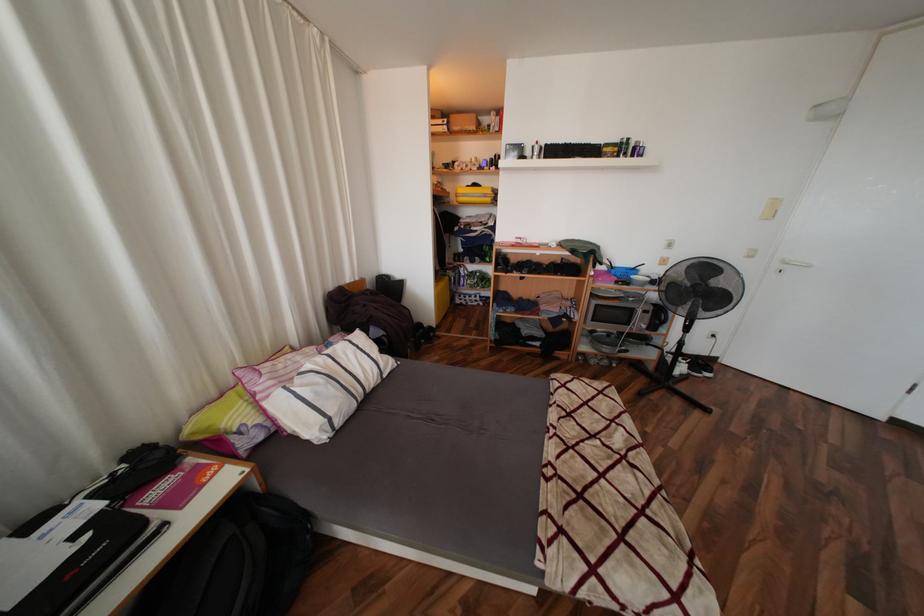
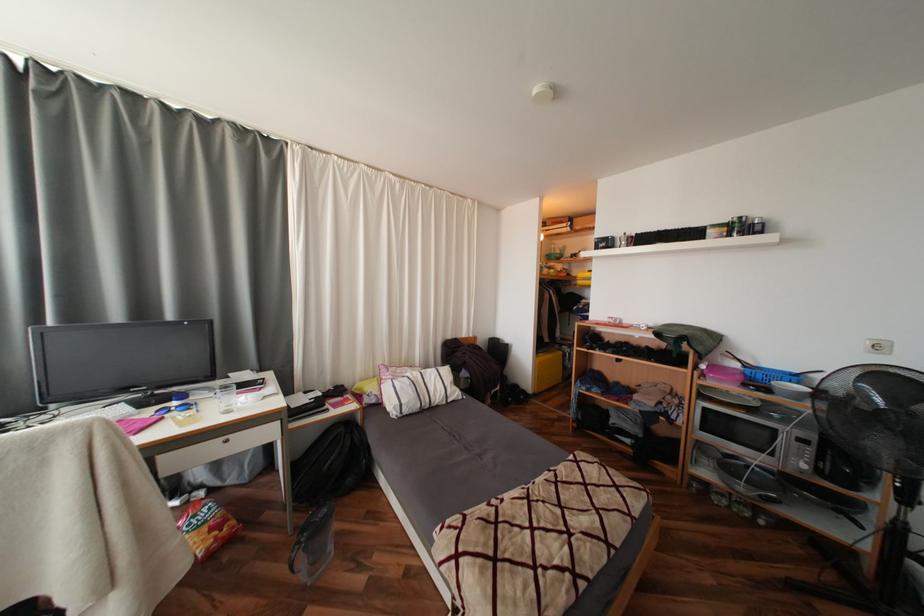
Question: Based on the continuous images, in which direction is the camera rotating? Reply with the corresponding letter.

Choices:
 (A) Left
 (B) Right
 (C) Up
 (D) Down

Answer: (A)